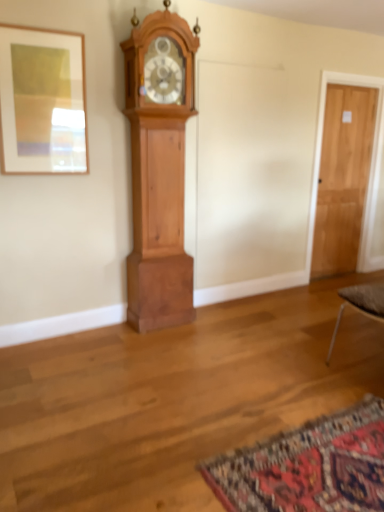
Find the location of a particular element. The image size is (384, 512). space that is in front of cherry wood grandfather clock at left is located at coordinates (169, 338).